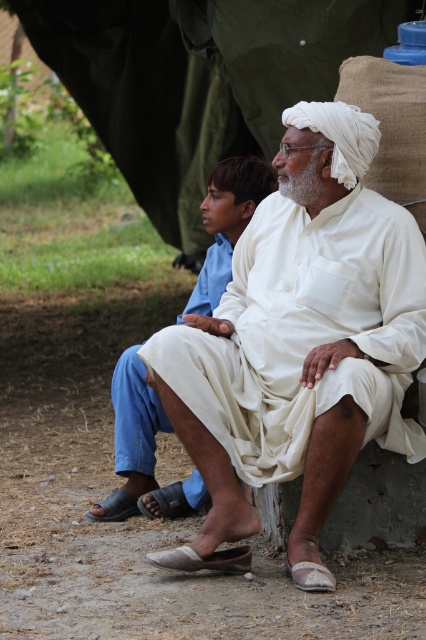
Question: Which object is farther from the camera taking this photo?

Choices:
 (A) white cotton dhoti at center
 (B) white cotton kurta at center

Answer: (B)

Question: Does white cotton turban at upper center have a lesser width compared to white cotton kurta at center?

Choices:
 (A) no
 (B) yes

Answer: (A)

Question: Estimate the real-world distances between objects in this image. Which object is farther from the white cotton dhoti at center?

Choices:
 (A) white cotton turban at upper center
 (B) white cotton kurta at center

Answer: (A)

Question: Which point is farther from the camera taking this photo?

Choices:
 (A) (204, 458)
 (B) (134, 406)
 (C) (216, 163)

Answer: (C)

Question: Does white cotton turban at upper center have a larger size compared to white cotton dhoti at center?

Choices:
 (A) yes
 (B) no

Answer: (A)

Question: Is white cotton kurta at center to the left of white cotton dhoti at center from the viewer's perspective?

Choices:
 (A) yes
 (B) no

Answer: (B)